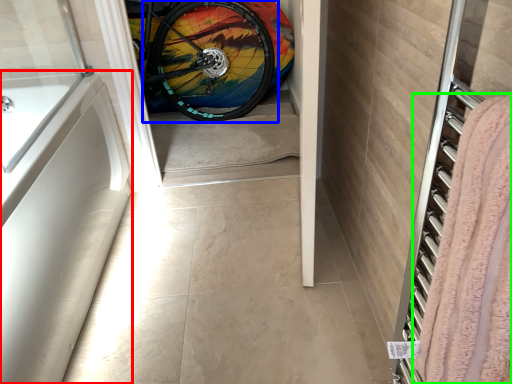
Question: Estimate the real-world distances between objects in this image. Which object is farther from bath (highlighted by a red box), bicycle wheel (highlighted by a blue box) or blanket (highlighted by a green box)?

Choices:
 (A) bicycle wheel
 (B) blanket

Answer: (A)